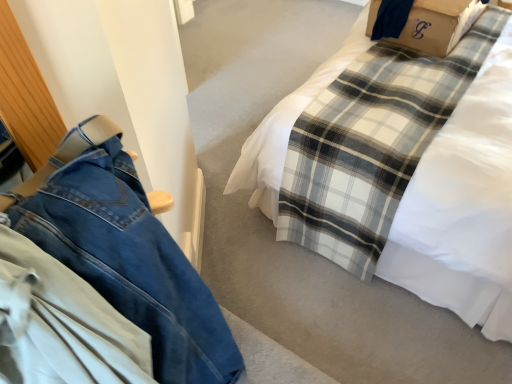
Question: Is brown cardboard box at upper right smaller than denim pants at left?

Choices:
 (A) yes
 (B) no

Answer: (A)

Question: Is brown cardboard box at upper right looking in the opposite direction of denim pants at left?

Choices:
 (A) yes
 (B) no

Answer: (B)

Question: From a real-world perspective, is brown cardboard box at upper right located higher than denim pants at left?

Choices:
 (A) yes
 (B) no

Answer: (B)

Question: Does brown cardboard box at upper right come in front of denim pants at left?

Choices:
 (A) yes
 (B) no

Answer: (B)

Question: Are brown cardboard box at upper right and denim pants at left far apart?

Choices:
 (A) yes
 (B) no

Answer: (A)

Question: Is brown cardboard box at upper right positioned beyond the bounds of denim pants at left?

Choices:
 (A) no
 (B) yes

Answer: (B)

Question: Does white plaid blanket at center appear on the left side of denim pants at left?

Choices:
 (A) yes
 (B) no

Answer: (B)

Question: Would you say denim pants at left is part of white plaid blanket at center's contents?

Choices:
 (A) yes
 (B) no

Answer: (B)

Question: Is white plaid blanket at center looking in the opposite direction of denim pants at left?

Choices:
 (A) yes
 (B) no

Answer: (B)

Question: Does white plaid blanket at center have a lesser height compared to denim pants at left?

Choices:
 (A) no
 (B) yes

Answer: (A)

Question: From the image's perspective, is white plaid blanket at center under denim pants at left?

Choices:
 (A) no
 (B) yes

Answer: (A)

Question: Is white plaid blanket at center not close to denim pants at left?

Choices:
 (A) yes
 (B) no

Answer: (A)

Question: Are white plaid blanket at center and brown cardboard box at upper right far apart?

Choices:
 (A) yes
 (B) no

Answer: (B)